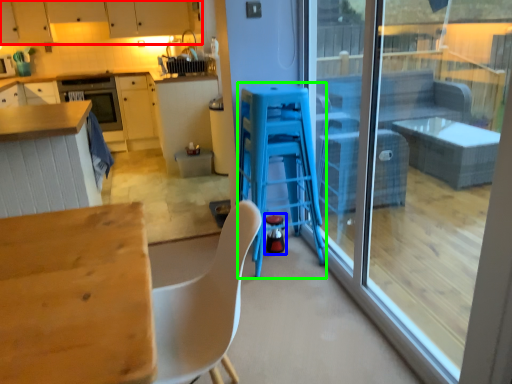
Question: Which object is the closest to the cabinetry (highlighted by a red box)? Choose among these: appliance (highlighted by a blue box) or bar stool (highlighted by a green box).

Choices:
 (A) appliance
 (B) bar stool

Answer: (B)